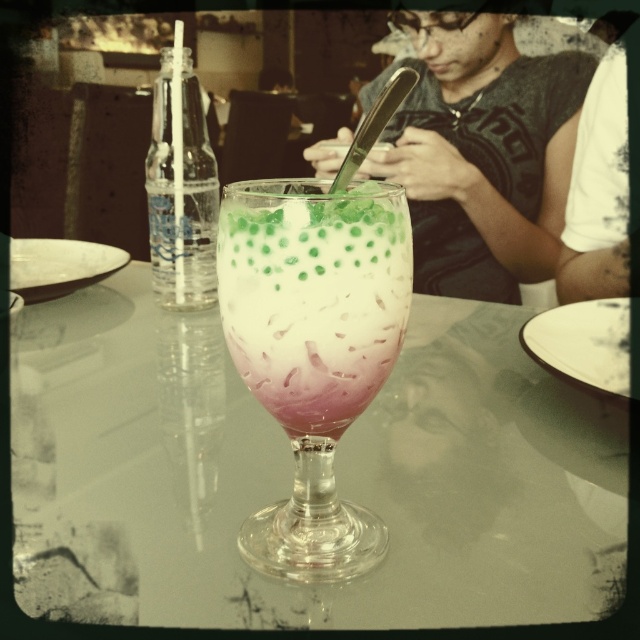
You are a delivery person who needs to place a large pizza box on the transparent glass table at center. However, you notice there is a clear plastic bottle at left on the table. Can you fit the pizza box on the table without moving the bottle?

The transparent glass table at center might be wider than clear plastic bottle at left, so there is a possibility that the pizza box can fit without moving the bottle, but it depends on the exact dimensions.

Looking at this image, you are a photographer taking a picture of the pink frosted glass at center and the dark gray shirt at center. Which object should you adjust to ensure both are centered in the frame?

The pink frosted glass at center is to the left of dark gray shirt at center, so you should move the pink frosted glass at center to the right to align both objects in the center of the frame.